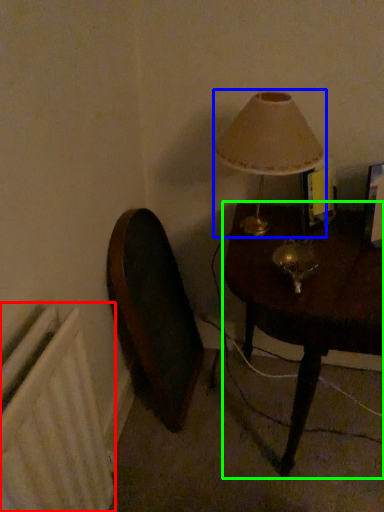
Question: Based on their relative distances, which object is farther from radiator (highlighted by a red box)? Choose from lamp (highlighted by a blue box) and table (highlighted by a green box).

Choices:
 (A) lamp
 (B) table

Answer: (A)